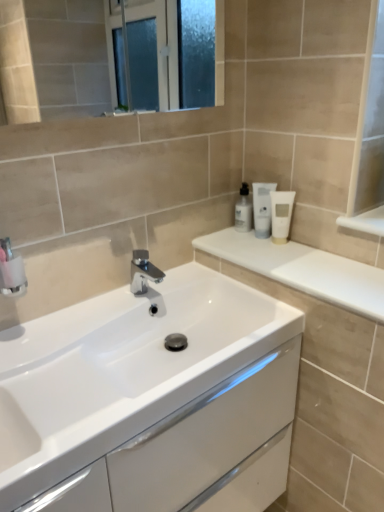
Question: Should I look upward or downward to see white glossy lotion at upper right, arranged as the first toiletry when viewed from the left?

Choices:
 (A) down
 (B) up

Answer: (B)

Question: Is chrome metallic faucet at center bigger than white glossy lotion at upper right, the 3th toiletry in the right-to-left sequence?

Choices:
 (A) yes
 (B) no

Answer: (A)

Question: From a real-world perspective, does chrome metallic faucet at center stand above white glossy lotion at upper right, arranged as the first toiletry when viewed from the left?

Choices:
 (A) no
 (B) yes

Answer: (A)

Question: Is chrome metallic faucet at center facing away from white glossy lotion at upper right, arranged as the first toiletry when viewed from the left?

Choices:
 (A) yes
 (B) no

Answer: (B)

Question: Considering the relative sizes of chrome metallic faucet at center and white glossy lotion at upper right, the 3th toiletry in the right-to-left sequence, in the image provided, is chrome metallic faucet at center smaller than white glossy lotion at upper right, the 3th toiletry in the right-to-left sequence,?

Choices:
 (A) yes
 (B) no

Answer: (B)

Question: Can you see chrome metallic faucet at center touching white glossy lotion at upper right, the 3th toiletry in the right-to-left sequence?

Choices:
 (A) no
 (B) yes

Answer: (A)

Question: Could you tell me if chrome metallic faucet at center is turned towards white glossy lotion at upper right, the 3th toiletry in the right-to-left sequence?

Choices:
 (A) yes
 (B) no

Answer: (B)

Question: Is white glossy countertop at upper right not near white matte tube at upper right, which is the second toiletry in left-to-right order?

Choices:
 (A) yes
 (B) no

Answer: (B)

Question: Is white glossy countertop at upper right thinner than white matte tube at upper right, which is the second toiletry in left-to-right order?

Choices:
 (A) yes
 (B) no

Answer: (B)

Question: Is white glossy countertop at upper right wider than white matte tube at upper right, which is the second toiletry in left-to-right order?

Choices:
 (A) yes
 (B) no

Answer: (A)

Question: Is white glossy countertop at upper right smaller than white matte tube at upper right, which is the second toiletry in left-to-right order?

Choices:
 (A) no
 (B) yes

Answer: (A)

Question: Considering the relative sizes of white glossy countertop at upper right and white matte tube at upper right, which is the 2th toiletry from right to left, in the image provided, is white glossy countertop at upper right taller than white matte tube at upper right, which is the 2th toiletry from right to left,?

Choices:
 (A) yes
 (B) no

Answer: (B)

Question: Is white glossy countertop at upper right facing away from white matte tube at upper right, which is the 2th toiletry from right to left?

Choices:
 (A) no
 (B) yes

Answer: (A)

Question: Is chrome metallic faucet at center at the right side of white matte tube at upper right, which is the 3th toiletry in left-to-right order?

Choices:
 (A) no
 (B) yes

Answer: (A)